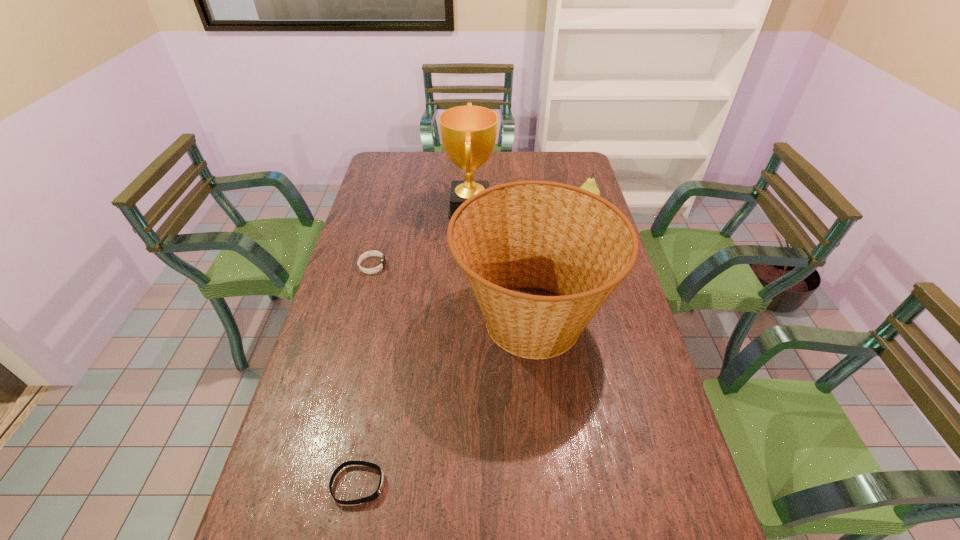
At what (x,y) coordinates should I click in order to perform the action: click on free location located 0.400m on the outer surface of the taller wristband. Please return your answer as a coordinate pair (x, y). This screenshot has height=540, width=960. Looking at the image, I should click on (504, 266).

Locate an element on the screen. Image resolution: width=960 pixels, height=540 pixels. vacant space situated on the display of the nearer wristband is located at coordinates pyautogui.click(x=407, y=484).

Where is `basket present at the right edge`? Image resolution: width=960 pixels, height=540 pixels. basket present at the right edge is located at coordinates (528, 234).

Find the location of a particular element. pear located at the right edge is located at coordinates (590, 185).

I want to click on vacant space at the far edge, so click(524, 152).

In the image, there is a desktop. At what (x,y) coordinates should I click in order to perform the action: click on vacant space at the left edge. Please return your answer as a coordinate pair (x, y). The width and height of the screenshot is (960, 540). Looking at the image, I should click on (389, 216).

This screenshot has width=960, height=540. Identify the location of free region at the right edge. (615, 303).

The width and height of the screenshot is (960, 540). I want to click on free point at the far right corner, so click(x=564, y=161).

Locate an element on the screen. vacant area that lies between the basket and the nearest object is located at coordinates (444, 402).

Locate an element on the screen. This screenshot has width=960, height=540. vacant space that is in between the basket and the shortest object is located at coordinates (444, 402).